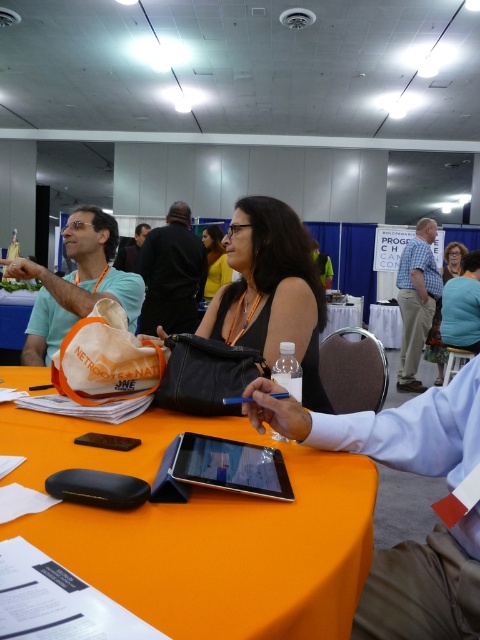
You are organizing a small meeting in the conference hall and need to place a new table. Based on the image, which object, the orange fabric table at center or the black fabric shirt at upper center, has a smaller footprint and would be more suitable for a space with limited area?

The orange fabric table at center occupies less space than the black fabric shirt at upper center, so it would be more suitable for a space with limited area.

You are navigating through the event hall and need to locate two specific points marked in the image. The first point is at coordinates point (409,337), and the second is at point (451,260). Which of these two points is closer to the front of the hall?

Point (409,337) is in front of point (451,260), so it is closer to the front of the hall.

You are organizing a photoshoot in this scene and need to place a 1.2 meter wide backdrop behind the two shirts. Given the width of the matte teal tank top at center and the black fabric shirt at upper center, which shirt should be placed closer to the edge of the backdrop to ensure both fit within its width?

The matte teal tank top at center is wider than the black fabric shirt at upper center. To fit both within the 1.2 meter backdrop, place the wider matte teal tank top at center closer to the edge opposite the narrower black fabric shirt at upper center, ensuring their combined width doesn